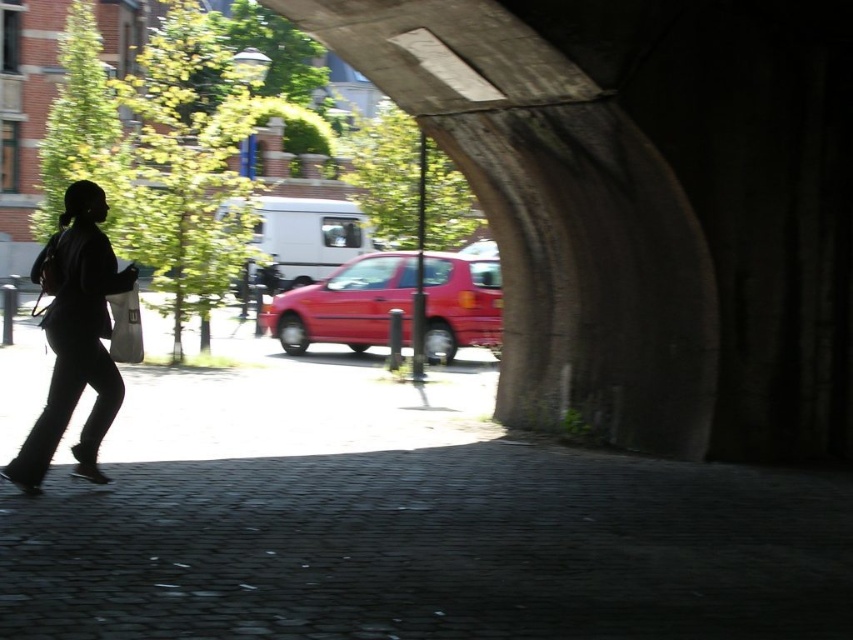
You are a delivery person who needs to place a new red car in the center of the image. The car must be placed below the black fabric bag at left. Is the shiny red car at center currently positioned correctly according to the requirements?

The black fabric bag at left has a greater height compared to shiny red car at center. Since the car must be placed below the bag, the current position of the shiny red car at center is correct as the bag is taller than the car.

You are a delivery person who needs to place a large package that is 1 meter wide. You see the black fabric bag at left and the shiny red car at center. Which object can you place the package next to without it overlapping?

The shiny red car at center has a greater width than the black fabric bag at left, so the package can be placed next to the shiny red car at center without overlapping.

You are a delivery person who needs to deliver a package to the shiny red car at center. You are currently holding the black fabric bag at left. Which object is smaller in size?

The black fabric bag at left has a smaller size compared to the shiny red car at center.